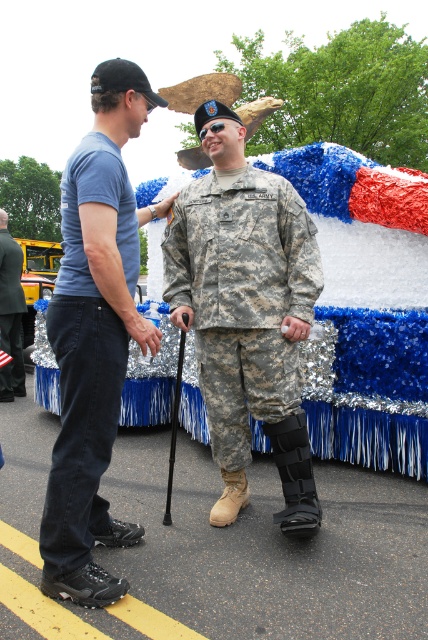
Can you confirm if camouflage fabric uniform at center is taller than brushed metal cane at left?

Correct, camouflage fabric uniform at center is much taller as brushed metal cane at left.

Is point (297, 451) positioned after point (2, 314)?

No, it is not.

Is point (299, 528) less distant than point (8, 234)?

Yes, point (299, 528) is in front of point (8, 234).

In order to click on camouflage fabric uniform at center in this screenshot , I will do `click(246, 312)`.

Does blue denim jeans at left have a larger size compared to brushed metal cane at left?

Yes.

Is blue denim jeans at left above brushed metal cane at left?

No, blue denim jeans at left is not above brushed metal cane at left.

Who is more forward, (70, 502) or (20, 288)?

Point (70, 502)

The width and height of the screenshot is (428, 640). Find the location of `blue denim jeans at left`. blue denim jeans at left is located at coordinates (95, 336).

Does camouflage fabric uniform at center appear over blue denim jeans at left?

Correct, camouflage fabric uniform at center is located above blue denim jeans at left.

Which is above, camouflage fabric uniform at center or blue denim jeans at left?

camouflage fabric uniform at center

Is point (196, 132) closer to viewer compared to point (95, 156)?

No, it is not.

You are a GUI agent. You are given a task and a screenshot of the screen. Output one action in this format:
    pyautogui.click(x=<x>, y=<y>)
    Task: Click on the camouflage fabric uniform at center
    The height and width of the screenshot is (640, 428).
    Given the screenshot: What is the action you would take?
    pyautogui.click(x=246, y=312)